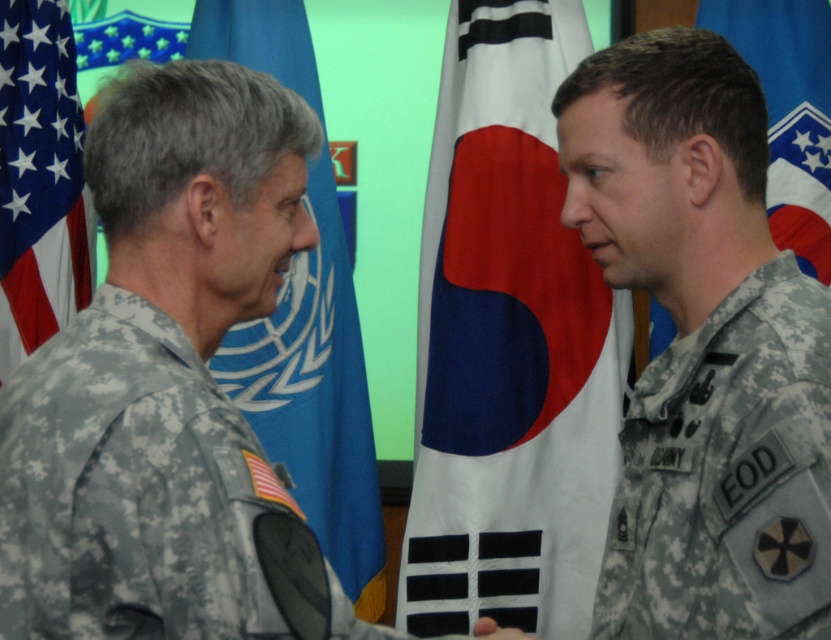
Question: Among these objects, which one is nearest to the camera?

Choices:
 (A) camouflage fabric uniform at right
 (B) matte fabric flag at left
 (C) camouflage fabric uniform at left
 (D) white fabric flag at center

Answer: (C)

Question: Among these points, which one is nearest to the camera?

Choices:
 (A) (509, 634)
 (B) (219, 412)
 (C) (485, 96)

Answer: (B)

Question: Does camouflage fabric uniform at right appear over blue fabric flag at right?

Choices:
 (A) no
 (B) yes

Answer: (A)

Question: Does camouflage fabric uniform at right come in front of blue fabric flag at left?

Choices:
 (A) yes
 (B) no

Answer: (A)

Question: Is the position of camouflage fabric uniform at left more distant than that of blue fabric flag at right?

Choices:
 (A) yes
 (B) no

Answer: (B)

Question: Which object appears farthest from the camera in this image?

Choices:
 (A) blue fabric flag at right
 (B) camouflage fabric uniform at right

Answer: (A)